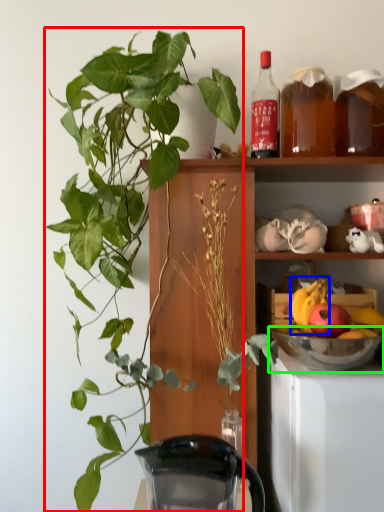
Question: Based on their relative distances, which object is farther from houseplant (highlighted by a red box)? Choose from fruit (highlighted by a blue box) and mixing bowl (highlighted by a green box).

Choices:
 (A) fruit
 (B) mixing bowl

Answer: (A)